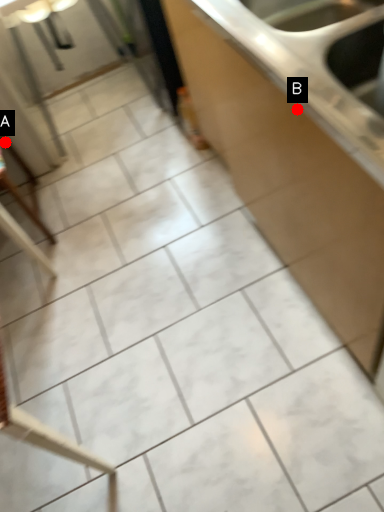
Question: Two points are circled on the image, labeled by A and B beside each circle. Which point is closer to the camera?

Choices:
 (A) A is closer
 (B) B is closer

Answer: (B)